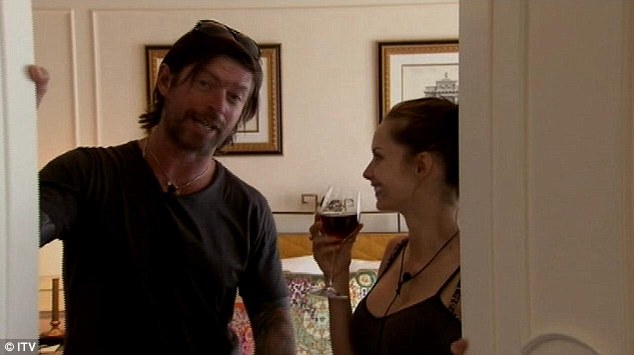
Find the location of `picture frames`. picture frames is located at coordinates (422, 47), (275, 55).